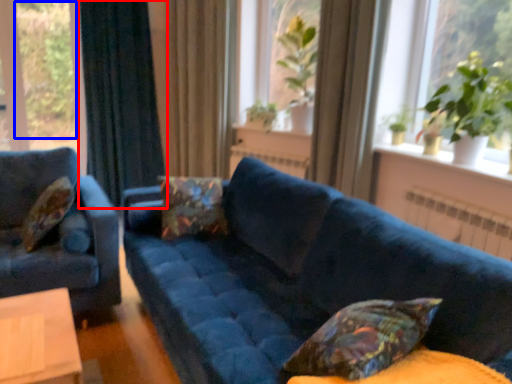
Question: Among these objects, which one is farthest to the camera, curtain (highlighted by a red box) or plant (highlighted by a blue box)?

Choices:
 (A) curtain
 (B) plant

Answer: (B)